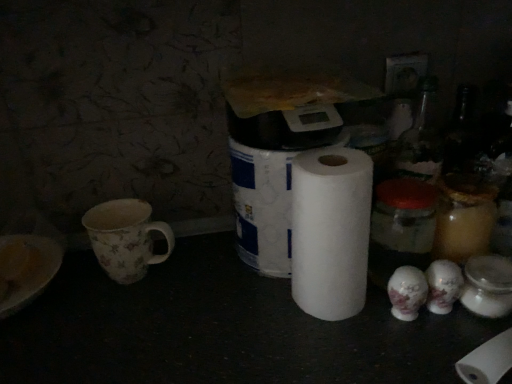
Find the location of `white matte toilet paper at center`. white matte toilet paper at center is located at coordinates (263, 207).

Between white matte toilet paper at center and white matte paper towel at center, which one has smaller size?

white matte paper towel at center is smaller.

In the scene shown: Considering the relative positions of white matte toilet paper at center and white matte paper towel at center in the image provided, is white matte toilet paper at center to the left of white matte paper towel at center from the viewer's perspective?

Correct, you'll find white matte toilet paper at center to the left of white matte paper towel at center.

Considering the points (245, 150) and (349, 151), which point is behind, point (245, 150) or point (349, 151)?

The point (245, 150) is farther from the camera.

How much distance is there between white matte toilet paper at center and white matte paper towel at center?

white matte toilet paper at center and white matte paper towel at center are 3.67 inches apart.

Is white matte paper towel at center surrounding floral-patterned ceramic mug at left?

Actually, floral-patterned ceramic mug at left is outside white matte paper towel at center.

Can you tell me how much white matte paper towel at center and floral-patterned ceramic mug at left differ in facing direction?

They differ by 0.00373 degrees in their facing directions.

Consider the image. Is white matte paper towel at center taller or shorter than floral-patterned ceramic mug at left?

white matte paper towel at center is taller than floral-patterned ceramic mug at left.

Which object is closer to the camera taking this photo, white matte paper towel at center or floral-patterned ceramic mug at left?

white matte paper towel at center is closer to the camera.

From a real-world perspective, is white matte toilet paper at center positioned above or below floral-patterned ceramic mug at left?

From a real-world perspective, white matte toilet paper at center is physically above floral-patterned ceramic mug at left.

Is white matte toilet paper at center closer to camera compared to floral-patterned ceramic mug at left?

That is True.

Is white matte toilet paper at center turned away from floral-patterned ceramic mug at left?

No.

From the image's perspective, is white matte toilet paper at center beneath floral-patterned ceramic mug at left?

Incorrect, from the image's perspective, white matte toilet paper at center is higher than floral-patterned ceramic mug at left.

From a real-world perspective, is floral-patterned ceramic mug at left physically above white matte paper towel at center?

No, from a real-world perspective, floral-patterned ceramic mug at left is not over white matte paper towel at center

Is floral-patterned ceramic mug at left wider than white matte paper towel at center?

Indeed, floral-patterned ceramic mug at left has a greater width compared to white matte paper towel at center.

From the image's perspective, is floral-patterned ceramic mug at left over white matte paper towel at center?

No, from the image's perspective, floral-patterned ceramic mug at left is not above white matte paper towel at center.

Could white matte toilet paper at center be considered to be inside floral-patterned ceramic mug at left?

No, floral-patterned ceramic mug at left does not contain white matte toilet paper at center.

Considering the sizes of floral-patterned ceramic mug at left and white matte toilet paper at center in the image, is floral-patterned ceramic mug at left taller or shorter than white matte toilet paper at center?

In the image, floral-patterned ceramic mug at left appears to be shorter than white matte toilet paper at center.

Is the position of floral-patterned ceramic mug at left less distant than that of white matte toilet paper at center?

No, floral-patterned ceramic mug at left is behind white matte toilet paper at center.

Is floral-patterned ceramic mug at left facing towards white matte toilet paper at center?

No.

From a real-world perspective, between white matte paper towel at center and white matte toilet paper at center, who is vertically lower?

white matte paper towel at center is physically lower.

Which object is further away from the camera, white matte paper towel at center or white matte toilet paper at center?

white matte toilet paper at center is behind.

Which is more to the right, white matte paper towel at center or white matte toilet paper at center?

white matte paper towel at center.

Is white matte paper towel at center taller or shorter than white matte toilet paper at center?

Considering their sizes, white matte paper towel at center has less height than white matte toilet paper at center.

Locate an element on the screen. The image size is (512, 384). toilet paper above the white matte paper towel at center (from a real-world perspective) is located at coordinates (263, 207).

Where is `coffee cup located underneath the white matte paper towel at center (from a real-world perspective)`? This screenshot has width=512, height=384. coffee cup located underneath the white matte paper towel at center (from a real-world perspective) is located at coordinates (125, 238).

Looking at the image, which one is located further to white matte paper towel at center, floral-patterned ceramic mug at left or white matte toilet paper at center?

Among the two, floral-patterned ceramic mug at left is located further to white matte paper towel at center.

Looking at this image, estimate the real-world distances between objects in this image. Which object is closer to white matte toilet paper at center, floral-patterned ceramic mug at left or white matte paper towel at center?

The object closer to white matte toilet paper at center is white matte paper towel at center.

Looking at this image, from the image, which object appears to be nearer to floral-patterned ceramic mug at left, white matte paper towel at center or white matte toilet paper at center?

white matte toilet paper at center.

When comparing their distances from floral-patterned ceramic mug at left, does white matte toilet paper at center or white matte paper towel at center seem closer?

Among the two, white matte toilet paper at center is located nearer to floral-patterned ceramic mug at left.

From the image, which object appears to be farther from white matte toilet paper at center, white matte paper towel at center or floral-patterned ceramic mug at left?

floral-patterned ceramic mug at left is positioned further to the anchor white matte toilet paper at center.

Which object lies nearer to the anchor point white matte paper towel at center, white matte toilet paper at center or floral-patterned ceramic mug at left?

Among the two, white matte toilet paper at center is located nearer to white matte paper towel at center.

Identify the location of toilet paper between floral-patterned ceramic mug at left and white matte paper towel at center in the horizontal direction. (263, 207).